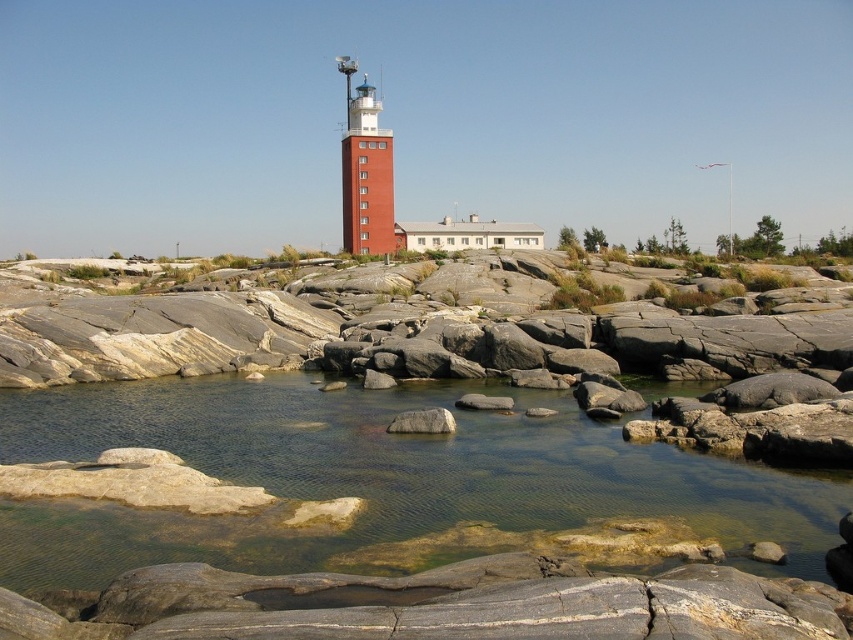
Question: Which is farther from the red brick tower at center?

Choices:
 (A) gray rock at center
 (B) clear water at center
 (C) gray smooth rock at center

Answer: (A)

Question: In this image, where is clear water at center located relative to gray rock at center?

Choices:
 (A) above
 (B) below

Answer: (B)

Question: Estimate the real-world distances between objects in this image. Which object is closer to the clear water at center?

Choices:
 (A) gray rock at center
 (B) red brick tower at center

Answer: (A)

Question: Does red brick tower at center have a greater width compared to gray rock at center?

Choices:
 (A) no
 (B) yes

Answer: (B)

Question: Based on their relative distances, which object is farther from the gray rock at center?

Choices:
 (A) clear water at center
 (B) red brick tower at center
 (C) gray smooth rock at center

Answer: (B)

Question: Is clear water at center in front of gray smooth rock at center?

Choices:
 (A) yes
 (B) no

Answer: (A)